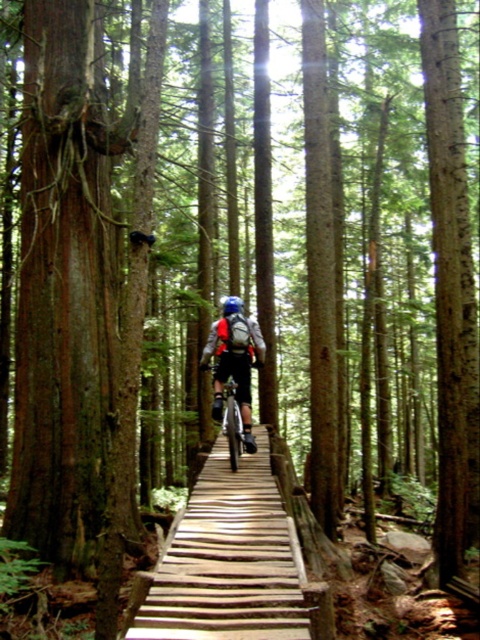
Which of these two, wooden planks bridge at center or silver metallic mountain bike at center, stands taller?

With more height is silver metallic mountain bike at center.

Can you confirm if wooden planks bridge at center is bigger than silver metallic mountain bike at center?

Yes.

Is point (171, 611) closer to viewer compared to point (235, 445)?

Yes, it is in front of point (235, 445).

Where is `wooden planks bridge at center`? The image size is (480, 640). wooden planks bridge at center is located at coordinates (230, 563).

Who is higher up, silver metallic mountain bike at center or blue matte helmet at center?

blue matte helmet at center is above.

Between silver metallic mountain bike at center and blue matte helmet at center, which one has more height?

With more height is blue matte helmet at center.

Between point (226, 416) and point (241, 305), which one is positioned in front?

Point (226, 416)

This screenshot has height=640, width=480. In order to click on silver metallic mountain bike at center in this screenshot , I will do `click(232, 422)`.

Can you confirm if wooden planks bridge at center is positioned below blue matte helmet at center?

Yes.

Is wooden planks bridge at center taller than blue matte helmet at center?

Incorrect, wooden planks bridge at center's height is not larger of blue matte helmet at center's.

The width and height of the screenshot is (480, 640). Describe the element at coordinates (230, 563) in the screenshot. I see `wooden planks bridge at center` at that location.

The width and height of the screenshot is (480, 640). What are the coordinates of `wooden planks bridge at center` in the screenshot? It's located at (230, 563).